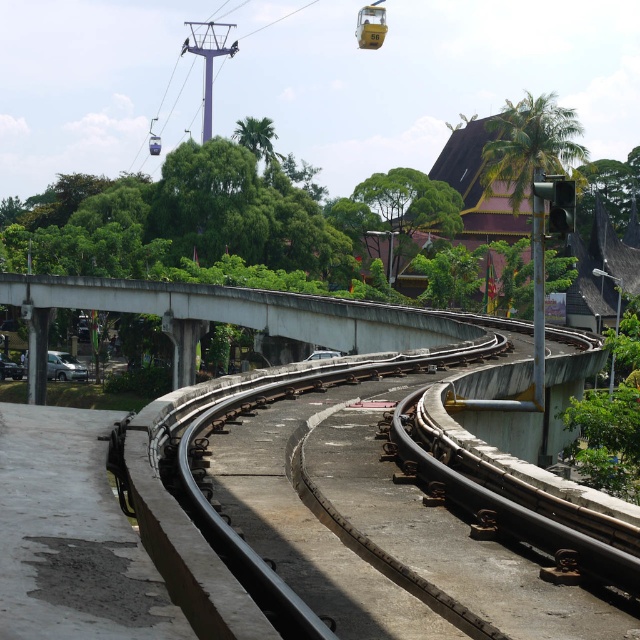
You are a delivery drone that needs to fly over the concrete at left and the metallic silver cable car at lower left to reach the destination. Which object do you need to fly higher over?

The concrete at left is much taller than the metallic silver cable car at lower left, so you need to fly higher over the concrete at left.

You are a delivery drone that needs to fly from the concrete at left to the metallic silver cable car at lower left. The drone has a maximum flight distance of 60 feet. Can you reach the destination without recharging?

The concrete at left and metallic silver cable car at lower left are 66.58 feet apart. Since the drone can only fly 60 feet before needing to recharge, it cannot reach the destination without recharging.

You are standing at the center of the image and want to walk to the concrete at left. In which direction should you move relative to the monorail track that curves to the right?

The concrete at left is located at point (234, 316). Since the monorail track curves to the right, moving towards the concrete at left would require walking in the opposite direction of the curve. Therefore, you should move to your left relative to the monorail track.